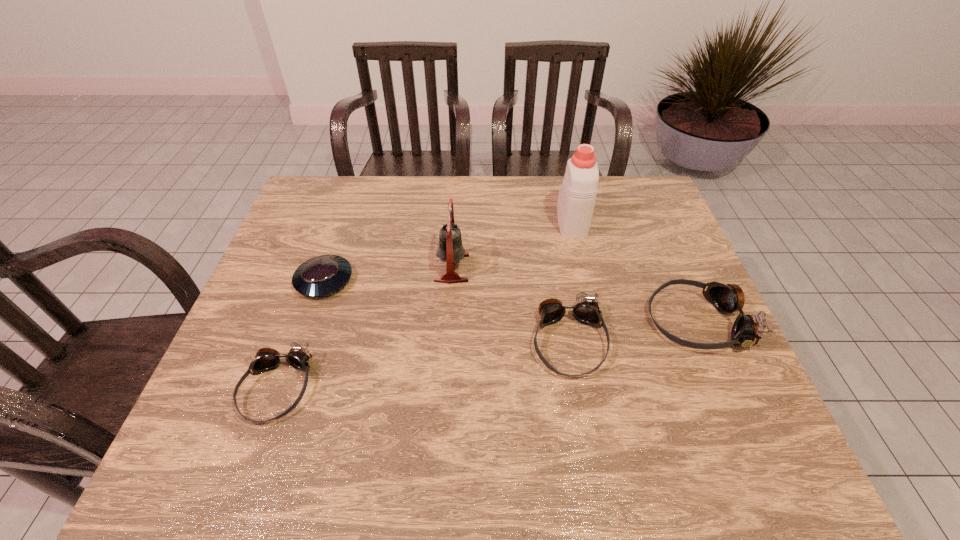
What are the coordinates of `location for an additional goggles to make spacing equal` in the screenshot? It's located at (429, 364).